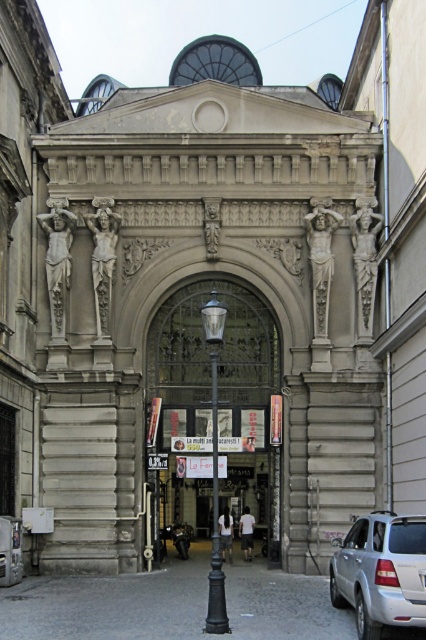
Question: Is polished brass streetlamp at center positioned before carved stone figure at center?

Choices:
 (A) yes
 (B) no

Answer: (A)

Question: Which point appears closest to the camera in this image?

Choices:
 (A) (63, 253)
 (B) (264, 333)
 (C) (213, 230)

Answer: (A)

Question: Which object is the farthest from the sculpted stone figure at center?

Choices:
 (A) silver metallic car at center
 (B) polished stone statue at right
 (C) matte stone statue at center
 (D) carved stone figure at center

Answer: (A)

Question: Which point is farther from the camera taking this photo?

Choices:
 (A) (307, 237)
 (B) (213, 236)
 (C) (354, 588)
 (D) (371, 317)

Answer: (A)

Question: Is polished brass streetlamp at center smaller than sculpted stone figure at center?

Choices:
 (A) yes
 (B) no

Answer: (B)

Question: Does polished brass streetlamp at center have a smaller size compared to sculpted stone figure at center?

Choices:
 (A) yes
 (B) no

Answer: (B)